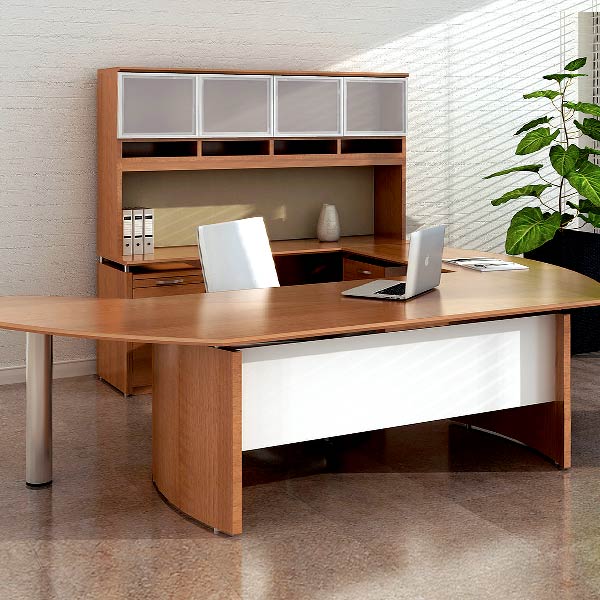
At what (x,y) coordinates should I click in order to perform the action: click on white brick wall behind desk. Please return your answer as a coordinate pair (x, y). Looking at the image, I should click on (442, 68).